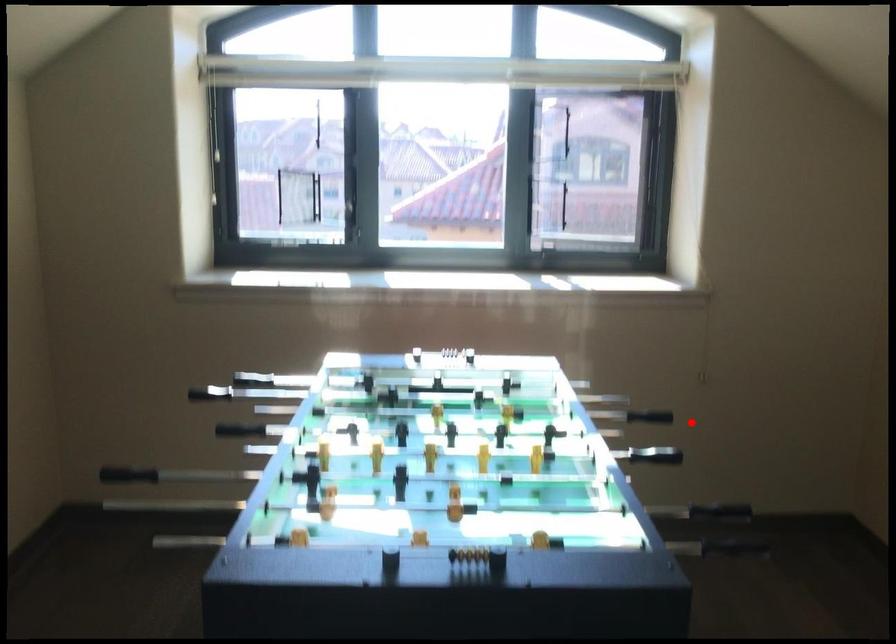
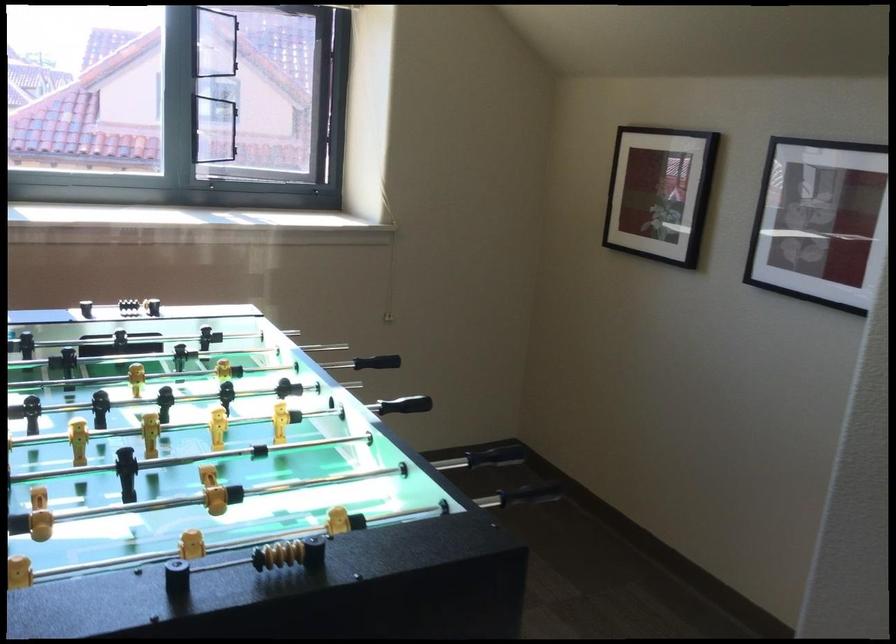
Locate, in the second image, the point that corresponds to the highlighted location in the first image.

(376, 362)